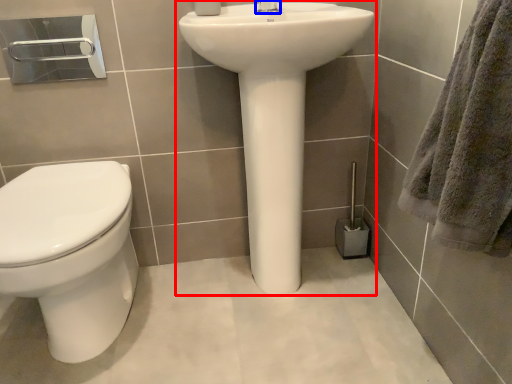
Question: Which object is further to the camera taking this photo, sink (highlighted by a red box) or tap (highlighted by a blue box)?

Choices:
 (A) sink
 (B) tap

Answer: (B)